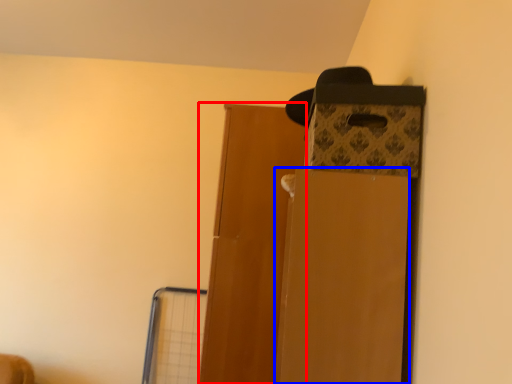
Question: Which of the following is the closest to the observer, door (highlighted by a red box) or cardboard box (highlighted by a blue box)?

Choices:
 (A) door
 (B) cardboard box

Answer: (B)